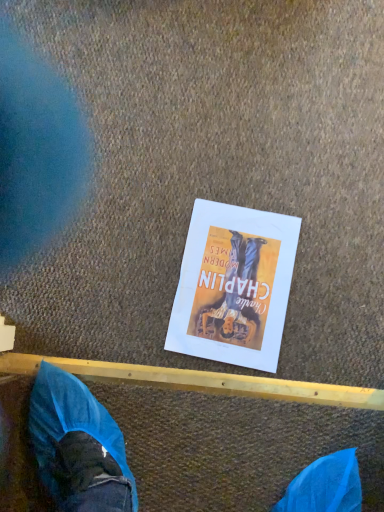
Image resolution: width=384 pixels, height=512 pixels. Identify the location of vacant area on top of white paper poster at center (from a real-world perspective). (236, 287).